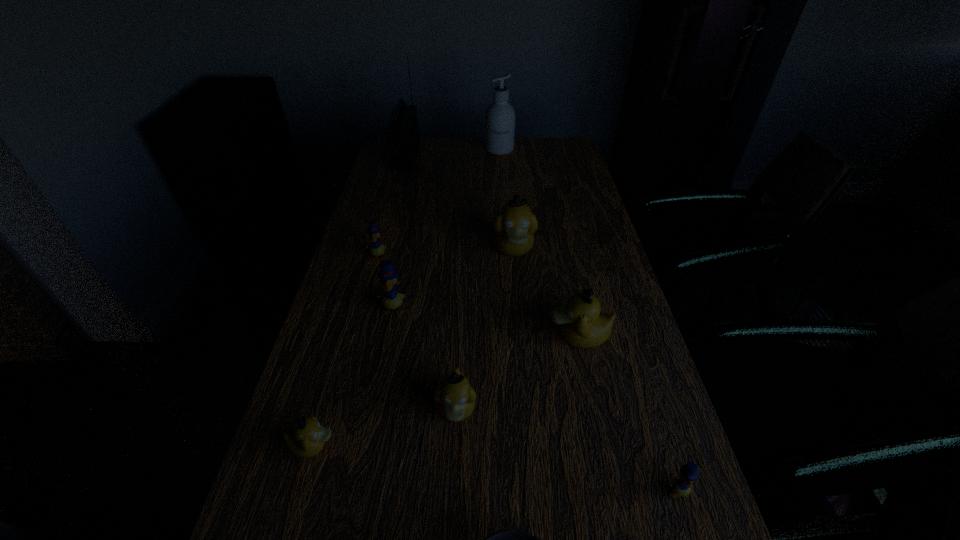
What are the coordinates of `blank space located 0.070m on the face of the third smallest tan duckling` in the screenshot? It's located at (518, 336).

At what (x,y) coordinates should I click in order to perform the action: click on vacant area situated on the face of the third farthest duckling, where the monocle is placed. Please return your answer as a coordinate pair (x, y). Image resolution: width=960 pixels, height=540 pixels. Looking at the image, I should click on (384, 352).

Locate an element on the screen. vacant area located 0.290m on the face of the farthest yellow duckling, where the monocle is placed is located at coordinates (355, 341).

Locate an element on the screen. This screenshot has height=540, width=960. free space located 0.110m on the face of the third biggest tan duckling is located at coordinates (452, 495).

Locate an element on the screen. The image size is (960, 540). vacant region located 0.280m on the face of the leftmost tan duckling is located at coordinates (481, 446).

The height and width of the screenshot is (540, 960). I want to click on radio receiver located at the far edge, so click(x=402, y=131).

Identify the location of cleansing agent at the far edge. (500, 115).

What are the coordinates of `radio receiver that is positioned at the left edge` in the screenshot? It's located at (402, 131).

What are the coordinates of `object positioned at the far left corner` in the screenshot? It's located at (402, 131).

Find the location of `free space at the far edge of the desktop`. free space at the far edge of the desktop is located at coordinates [436, 147].